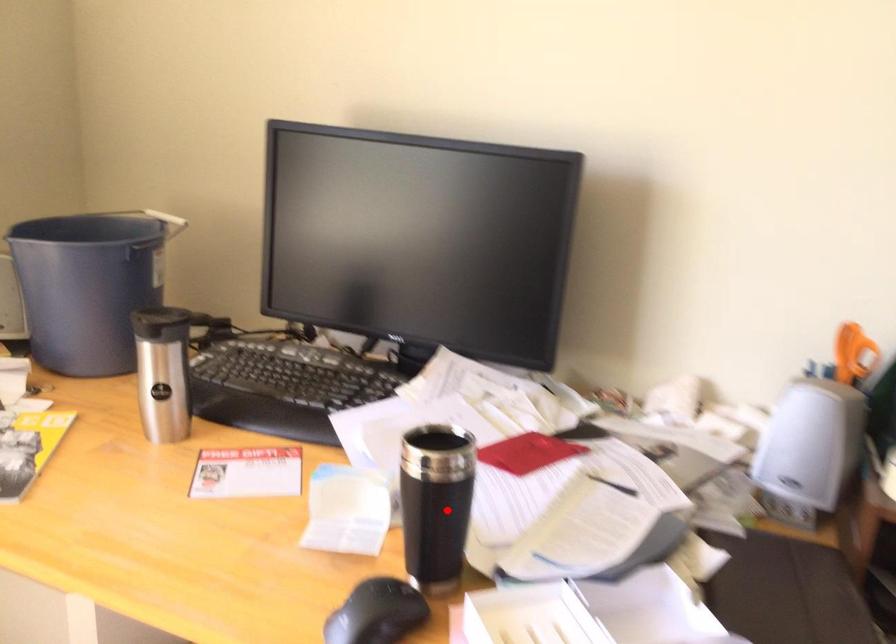
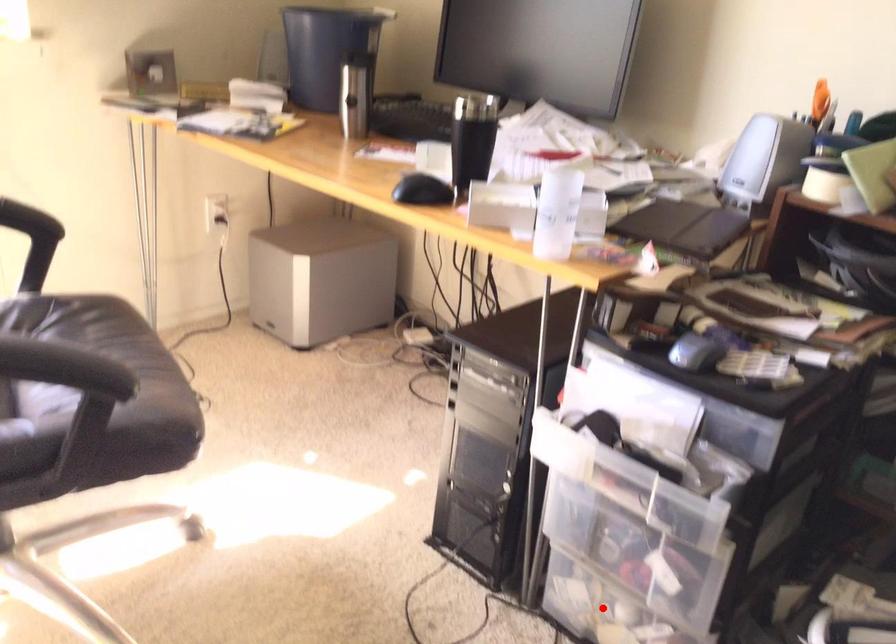
I am providing you with two images of the same scene from different viewpoints. A red point is marked on the first image and another point is marked on the second image. Is the marked point in image1 the same physical position as the marked point in image2?

No